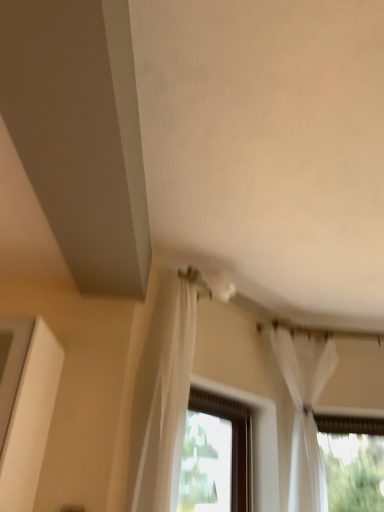
In order to face white sheer curtain at upper right, should I rotate leftwards or rightwards?

Turn right by 14.957 degrees to look at white sheer curtain at upper right.

Find the location of a particular element. white sheer curtain at upper right is located at coordinates (305, 412).

What do you see at coordinates (305, 412) in the screenshot?
I see `white sheer curtain at upper right` at bounding box center [305, 412].

Locate an element on the screen. This screenshot has width=384, height=512. brown wooden window at center is located at coordinates (216, 456).

The image size is (384, 512). Describe the element at coordinates (216, 456) in the screenshot. I see `brown wooden window at center` at that location.

Where is `white sheer curtain at upper right`? The width and height of the screenshot is (384, 512). white sheer curtain at upper right is located at coordinates (305, 412).

Considering the positions of objects brown wooden window at center and white sheer curtain at upper right in the image provided, who is more to the right, brown wooden window at center or white sheer curtain at upper right?

From the viewer's perspective, white sheer curtain at upper right appears more on the right side.

Is brown wooden window at center in front of white sheer curtain at upper right?

Yes, the depth of brown wooden window at center is less than that of white sheer curtain at upper right.

Does point (208, 434) appear closer or farther from the camera than point (312, 461)?

Clearly, point (208, 434) is more distant from the camera than point (312, 461).

From the image's perspective, is brown wooden window at center positioned above or below white sheer curtain at upper right?

brown wooden window at center is situated lower than white sheer curtain at upper right in the image.

In the scene shown: From a real-world perspective, which object stands above the other?

white sheer curtain at upper right, from a real-world perspective.

Considering the sizes of objects brown wooden window at center and white sheer curtain at upper right in the image provided, who is thinner, brown wooden window at center or white sheer curtain at upper right?

Thinner between the two is brown wooden window at center.

Considering the sizes of objects brown wooden window at center and white sheer curtain at upper right in the image provided, who is shorter, brown wooden window at center or white sheer curtain at upper right?

brown wooden window at center.

Between brown wooden window at center and white sheer curtain at upper right, which one has larger size?

Bigger between the two is white sheer curtain at upper right.

Choose the correct answer: Is brown wooden window at center inside white sheer curtain at upper right or outside it?

brown wooden window at center is not inside white sheer curtain at upper right, it's outside.

Is brown wooden window at center far away from white sheer curtain at upper right?

No.

From the picture: Could you tell me if brown wooden window at center is turned towards white sheer curtain at upper right?

Yes, brown wooden window at center is aimed at white sheer curtain at upper right.

How many degrees apart are the facing directions of brown wooden window at center and white sheer curtain at upper right?

The angular difference between brown wooden window at center and white sheer curtain at upper right is 20.8 degrees.

Measure the distance between brown wooden window at center and white sheer curtain at upper right.

They are 17.68 inches apart.

Image resolution: width=384 pixels, height=512 pixels. Find the location of `window below the white sheer curtain at upper right (from the image's perspective)`. window below the white sheer curtain at upper right (from the image's perspective) is located at coordinates (216, 456).

Considering the positions of objects white sheer curtain at upper right and brown wooden window at center in the image provided, who is more to the left, white sheer curtain at upper right or brown wooden window at center?

brown wooden window at center.

Does white sheer curtain at upper right come behind brown wooden window at center?

Yes, it is.

Is point (310, 388) positioned after point (225, 443)?

No, (310, 388) is closer to viewer.

From the image's perspective, between white sheer curtain at upper right and brown wooden window at center, who is located below?

brown wooden window at center is shown below in the image.

From a real-world perspective, is white sheer curtain at upper right beneath brown wooden window at center?

No.

Which of these two, white sheer curtain at upper right or brown wooden window at center, is wider?

white sheer curtain at upper right is wider.

Who is shorter, white sheer curtain at upper right or brown wooden window at center?

With less height is brown wooden window at center.

Can you confirm if white sheer curtain at upper right is bigger than brown wooden window at center?

Indeed, white sheer curtain at upper right has a larger size compared to brown wooden window at center.

Is white sheer curtain at upper right located outside brown wooden window at center?

Absolutely, white sheer curtain at upper right is external to brown wooden window at center.

Is white sheer curtain at upper right positioned far away from brown wooden window at center?

Actually, white sheer curtain at upper right and brown wooden window at center are a little close together.

Is brown wooden window at center at the back of white sheer curtain at upper right?

white sheer curtain at upper right does not have its back to brown wooden window at center.

What's the angular difference between white sheer curtain at upper right and brown wooden window at center's facing directions?

20.8 degrees separate the facing orientations of white sheer curtain at upper right and brown wooden window at center.

The height and width of the screenshot is (512, 384). In order to click on curtain positioned vertically above the brown wooden window at center (from a real-world perspective) in this screenshot , I will do `click(305, 412)`.

Locate an element on the screen. window located on the left of white sheer curtain at upper right is located at coordinates (216, 456).

The height and width of the screenshot is (512, 384). I want to click on curtain on the right of brown wooden window at center, so click(x=305, y=412).